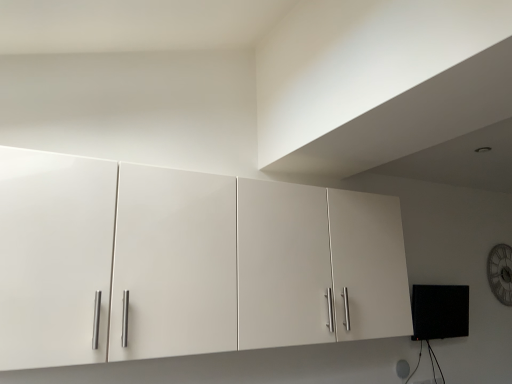
Question: Is white glossy cabinet at upper center taller or shorter than wooden clock at upper right?

Choices:
 (A) short
 (B) tall

Answer: (B)

Question: From the image's perspective, is white glossy cabinet at upper center located above or below wooden clock at upper right?

Choices:
 (A) above
 (B) below

Answer: (A)

Question: Relative to wooden clock at upper right, is white glossy cabinet at upper center in front or behind?

Choices:
 (A) front
 (B) behind

Answer: (A)

Question: Is wooden clock at upper right spatially inside white glossy cabinet at upper center, or outside of it?

Choices:
 (A) outside
 (B) inside

Answer: (A)

Question: From the image's perspective, is wooden clock at upper right above or below white glossy cabinet at upper center?

Choices:
 (A) below
 (B) above

Answer: (A)

Question: In the image, is wooden clock at upper right on the left side or the right side of white glossy cabinet at upper center?

Choices:
 (A) left
 (B) right

Answer: (B)

Question: Is point (497, 283) positioned closer to the camera than point (279, 269)?

Choices:
 (A) closer
 (B) farther

Answer: (B)